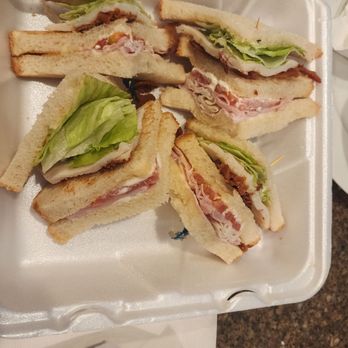
Identify the location of napkin. (178, 337).